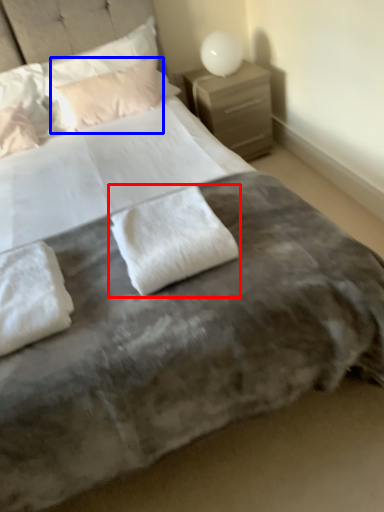
Question: Which object appears closest to the camera in this image, pillow (highlighted by a red box) or pillow (highlighted by a blue box)?

Choices:
 (A) pillow
 (B) pillow

Answer: (A)